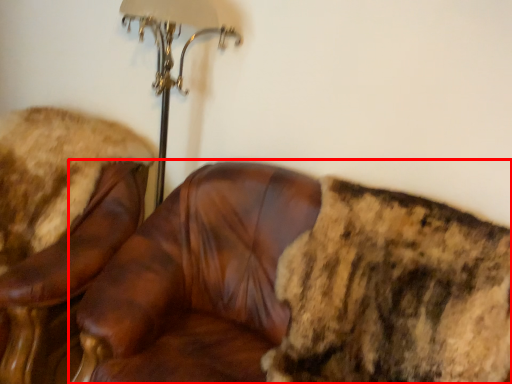
Question: Where is chair (annotated by the red box) located in relation to chair in the image?

Choices:
 (A) right
 (B) left

Answer: (A)